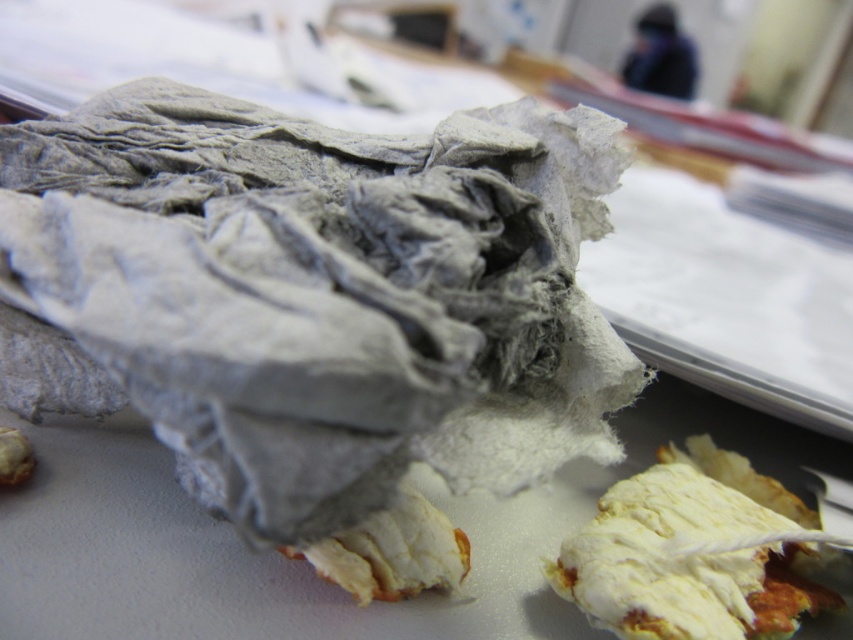
Is white crumbly bread at lower right closer to the viewer compared to white crumbly dough at lower center?

No, it is not.

Find the location of a particular element. The height and width of the screenshot is (640, 853). white crumbly bread at lower right is located at coordinates (694, 552).